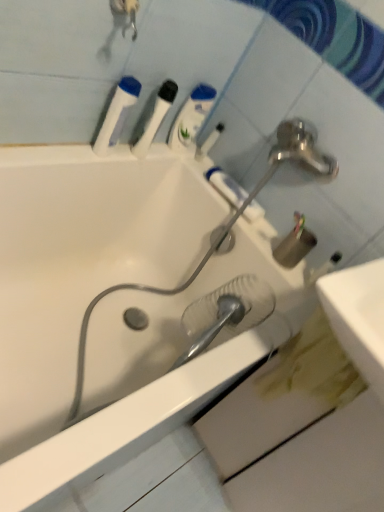
Question: Looking at their shapes, would you say translucent plastic shower head at center is wider or thinner than white plastic toothbrush at upper center?

Choices:
 (A) thin
 (B) wide

Answer: (B)

Question: Based on their sizes in the image, would you say translucent plastic shower head at center is bigger or smaller than white plastic toothbrush at upper center?

Choices:
 (A) big
 (B) small

Answer: (A)

Question: Which object is the closest to the white plastic toothbrush at upper center?

Choices:
 (A) white glossy bathtub at center
 (B) translucent plastic shower head at center
 (C) white matte toothpaste at upper center
 (D) white plastic toothbrush at upper center, placed as the second mouthwash when sorted from right to left
 (E) white plastic bottle at upper center, acting as the third mouthwash starting from the left

Answer: (E)

Question: Which of these objects is positioned farthest from the white glossy bathtub at center?

Choices:
 (A) white matte toothpaste at upper center
 (B) white plastic toothbrush at upper center, positioned as the second mouthwash in left-to-right order
 (C) white plastic bottle at upper center, acting as the third mouthwash starting from the left
 (D) white plastic bottle at upper left, which is counted as the third mouthwash, starting from the right
 (E) translucent plastic shower head at center

Answer: (C)